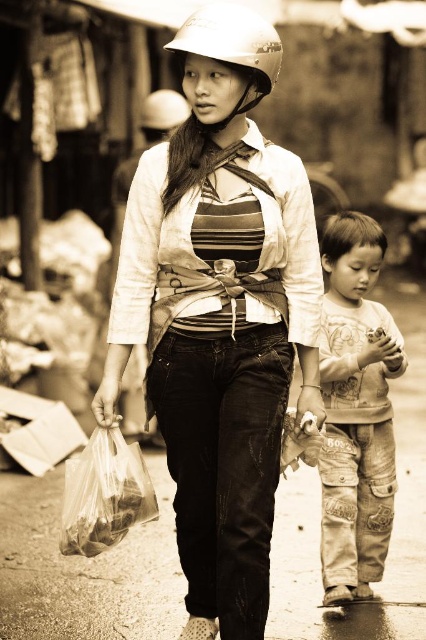
From the picture: Can you confirm if translucent plastic bag at lower left is positioned to the left of matte white helmet at upper center?

Correct, you'll find translucent plastic bag at lower left to the left of matte white helmet at upper center.

Is translucent plastic bag at lower left thinner than matte white helmet at upper center?

Indeed, translucent plastic bag at lower left has a lesser width compared to matte white helmet at upper center.

Does point (89, 544) lie in front of point (259, 42)?

Yes, point (89, 544) is in front of point (259, 42).

Locate an element on the screen. The height and width of the screenshot is (640, 426). translucent plastic bag at lower left is located at coordinates (103, 493).

Is matte black helmet at center below translucent plastic bag at lower left?

No, matte black helmet at center is not below translucent plastic bag at lower left.

Is matte black helmet at center smaller than translucent plastic bag at lower left?

Incorrect, matte black helmet at center is not smaller in size than translucent plastic bag at lower left.

Describe the element at coordinates (219, 314) in the screenshot. I see `matte black helmet at center` at that location.

Image resolution: width=426 pixels, height=640 pixels. I want to click on matte black helmet at center, so click(x=219, y=314).

Who is shorter, matte black helmet at center or matte white helmet at upper center?

matte white helmet at upper center is shorter.

Based on the photo, is matte black helmet at center shorter than matte white helmet at upper center?

Incorrect, matte black helmet at center's height does not fall short of matte white helmet at upper center's.

Does point (218, 134) lie behind point (226, 65)?

Yes.

Locate an element on the screen. The image size is (426, 640). matte black helmet at center is located at coordinates (219, 314).